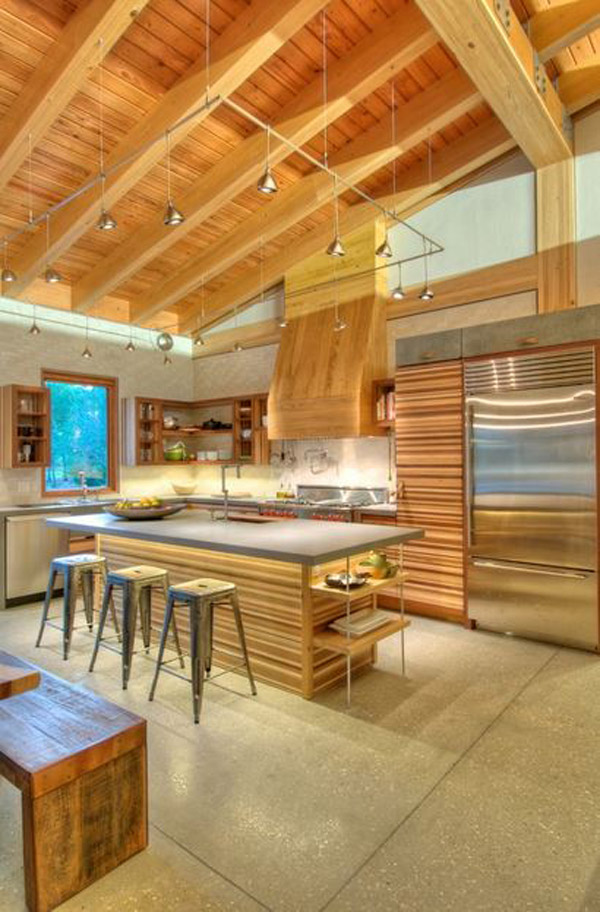
The image size is (600, 912). Find the location of `freezer compartment`. freezer compartment is located at coordinates [x=510, y=589].